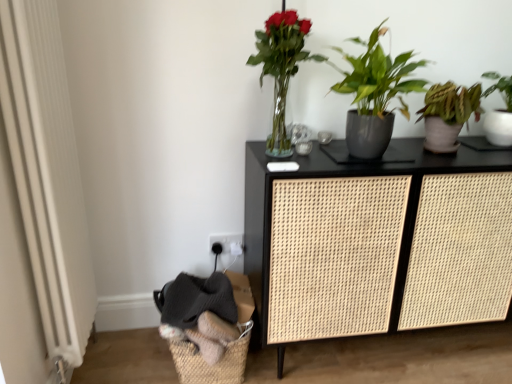
Where is `free point to the right of white textured radiator at left`? The image size is (512, 384). free point to the right of white textured radiator at left is located at coordinates (130, 367).